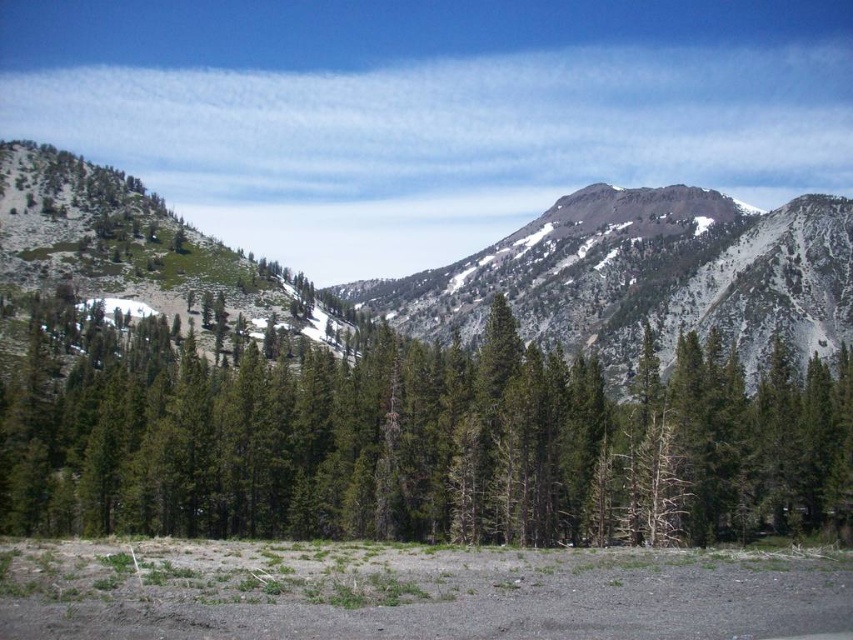
Question: Is green matte tree at center below green textured mountain at center?

Choices:
 (A) yes
 (B) no

Answer: (A)

Question: Which point appears closest to the camera in this image?

Choices:
 (A) (210, 461)
 (B) (45, 180)

Answer: (A)

Question: Which of the following is the farthest from the observer?

Choices:
 (A) (579, 305)
 (B) (807, 524)

Answer: (A)

Question: Considering the relative positions of green matte tree at center and green textured mountain at center in the image provided, where is green matte tree at center located with respect to green textured mountain at center?

Choices:
 (A) left
 (B) right

Answer: (B)

Question: Which point is farther to the camera?

Choices:
 (A) (782, 424)
 (B) (181, 289)

Answer: (B)

Question: Can you confirm if green matte tree at center is positioned to the left of green textured mountain at center?

Choices:
 (A) no
 (B) yes

Answer: (A)